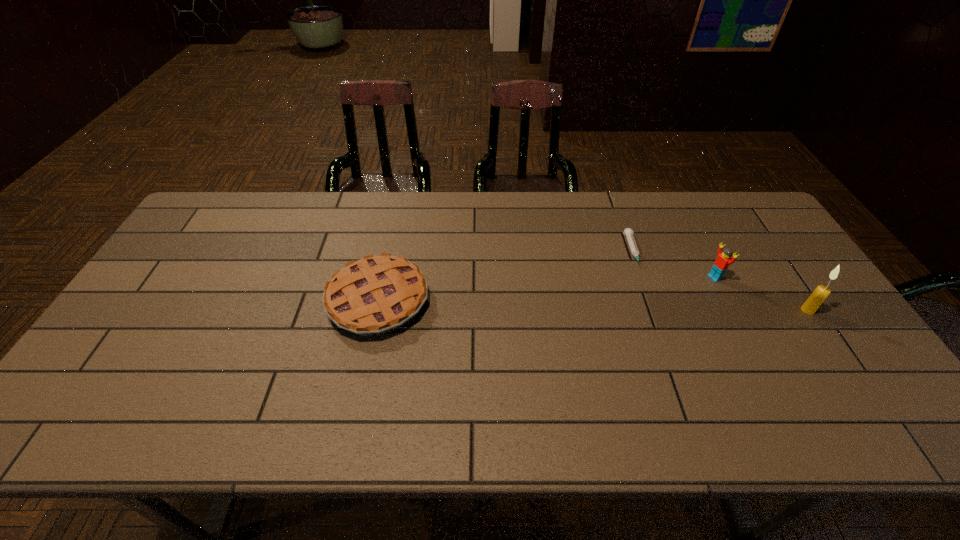
This screenshot has height=540, width=960. What are the coordinates of `free space between the Lego and the third tallest object` in the screenshot? It's located at (546, 289).

Where is `vacant space that's between the shortest object and the second shortest object`? This screenshot has width=960, height=540. vacant space that's between the shortest object and the second shortest object is located at coordinates (506, 276).

Identify the location of empty location between the tallest object and the second tallest object. (761, 294).

Locate which object is the second closest to the second object from right to left. Please provide its 2D coordinates. Your answer should be formatted as a tuple, i.e. [(x, y)], where the tuple contains the x and y coordinates of a point satisfying the conditions above.

[(811, 305)]

Select which object appears as the second closest to the shortest object. Please provide its 2D coordinates. Your answer should be formatted as a tuple, i.e. [(x, y)], where the tuple contains the x and y coordinates of a point satisfying the conditions above.

[(811, 305)]

Locate an element on the screen. free space that satisfies the following two spatial constraints: 1. on the front side of the leftmost object; 2. on the right side of the tallest object is located at coordinates (376, 310).

Where is `vacant area that satisfies the following two spatial constraints: 1. on the back side of the leftmost object; 2. on the left side of the syringe`? vacant area that satisfies the following two spatial constraints: 1. on the back side of the leftmost object; 2. on the left side of the syringe is located at coordinates (389, 251).